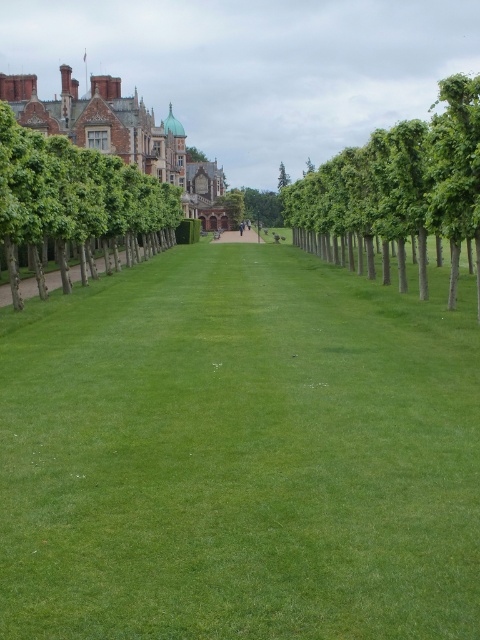
Between green leafy trees at center and green leafy tree at left, which one appears on the right side from the viewer's perspective?

green leafy trees at center

Is green leafy trees at center bigger than green leafy tree at left?

Answer: Yes.

Where is `green leafy trees at center`? green leafy trees at center is located at coordinates (404, 182).

This screenshot has height=640, width=480. Identify the location of green leafy trees at center. (x=404, y=182).

Can you confirm if green leafy trees at center is wider than smooth stone path at center?

Yes, green leafy trees at center is wider than smooth stone path at center.

Is green leafy trees at center further to camera compared to smooth stone path at center?

No, green leafy trees at center is in front of smooth stone path at center.

Is point (429, 148) in front of point (235, 241)?

Yes, point (429, 148) is in front of point (235, 241).

Where is `green leafy trees at center`? This screenshot has height=640, width=480. green leafy trees at center is located at coordinates (404, 182).

Between point (157, 342) and point (218, 240), which one is positioned in front?

Point (157, 342) is more forward.

From the picture: Does green smooth lawn at center have a lesser width compared to smooth stone path at center?

Incorrect, green smooth lawn at center's width is not less than smooth stone path at center's.

Does point (350, 470) come in front of point (237, 230)?

That is True.

You are a GUI agent. You are given a task and a screenshot of the screen. Output one action in this format:
    pyautogui.click(x=<x>, y=<y>)
    Task: Click on the green smooth lawn at center
    The image size is (480, 640).
    Given the screenshot: What is the action you would take?
    pyautogui.click(x=240, y=454)